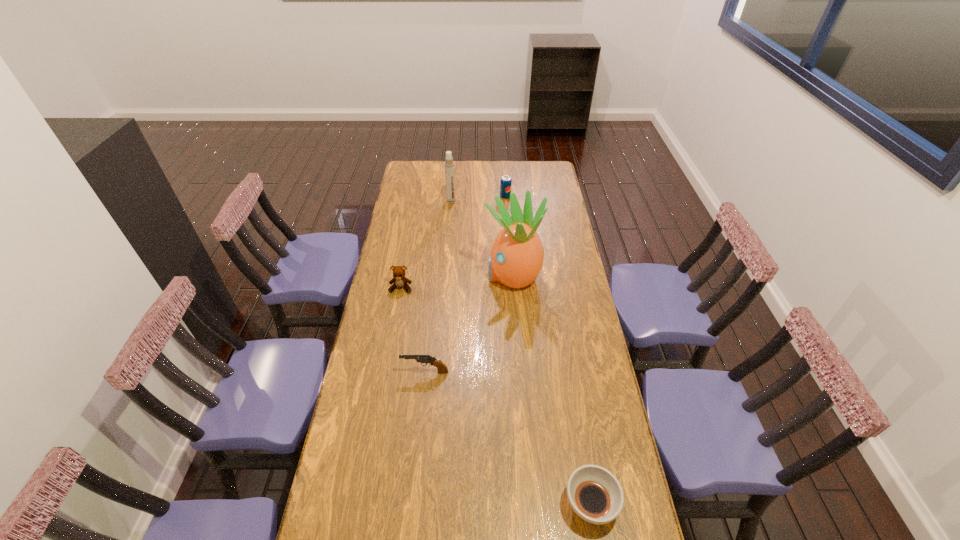
The image size is (960, 540). Identify the location of vacant space in between the aerosol can and the soup bowl. (520, 353).

In order to click on empty space between the gun and the pineapple in this screenshot , I will do `click(468, 323)`.

I want to click on vacant area between the pineapple and the soup bowl, so click(x=551, y=390).

The height and width of the screenshot is (540, 960). Identify the location of free point between the pop soda and the gun. (466, 284).

This screenshot has height=540, width=960. What are the coordinates of `object that is the fifth closest to the tallest object` in the screenshot? It's located at (594, 493).

This screenshot has height=540, width=960. I want to click on the closest object to the pop soda, so click(449, 164).

Locate an element on the screen. The image size is (960, 540). free space that satisfies the following two spatial constraints: 1. along the barrel of the gun; 2. on the left side of the pop soda is located at coordinates (444, 196).

Locate an element on the screen. vacant space that satisfies the following two spatial constraints: 1. on the back side of the nearest object; 2. at the entrance of the pineapple is located at coordinates (551, 275).

Where is `free space that satisfies the following two spatial constraints: 1. along the barrel of the pop soda; 2. on the right side of the second nearest object`? The width and height of the screenshot is (960, 540). free space that satisfies the following two spatial constraints: 1. along the barrel of the pop soda; 2. on the right side of the second nearest object is located at coordinates (444, 196).

The height and width of the screenshot is (540, 960). Find the location of `vacant space that satisfies the following two spatial constraints: 1. on the front side of the nearest object; 2. on the right side of the second tallest object`. vacant space that satisfies the following two spatial constraints: 1. on the front side of the nearest object; 2. on the right side of the second tallest object is located at coordinates (426, 504).